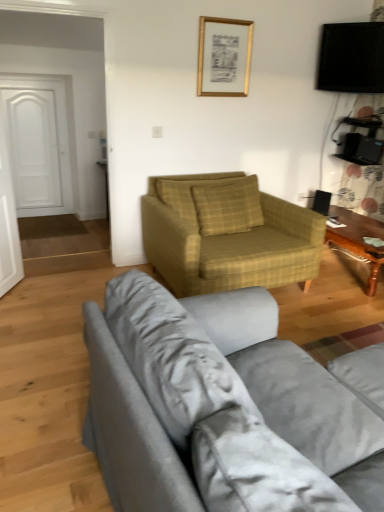
Question: Is point (249, 39) positioned closer to the camera than point (13, 132)?

Choices:
 (A) closer
 (B) farther

Answer: (A)

Question: From the image's perspective, is gold metallic picture frame at upper center located above or below white matte door at left?

Choices:
 (A) below
 (B) above

Answer: (B)

Question: Which object is positioned closest to the wooden polished coffee table at right?

Choices:
 (A) black glossy tv at upper right
 (B) yellow plaid pillow at center
 (C) gray fabric couch at center
 (D) yellow plaid fabric armchair at center
 (E) white matte door at left

Answer: (B)

Question: Considering the real-world distances, which object is closest to the white matte door at left?

Choices:
 (A) wooden polished coffee table at right
 (B) yellow plaid fabric armchair at center
 (C) gray fabric couch at center
 (D) yellow plaid pillow at center
 (E) gold metallic picture frame at upper center

Answer: (E)